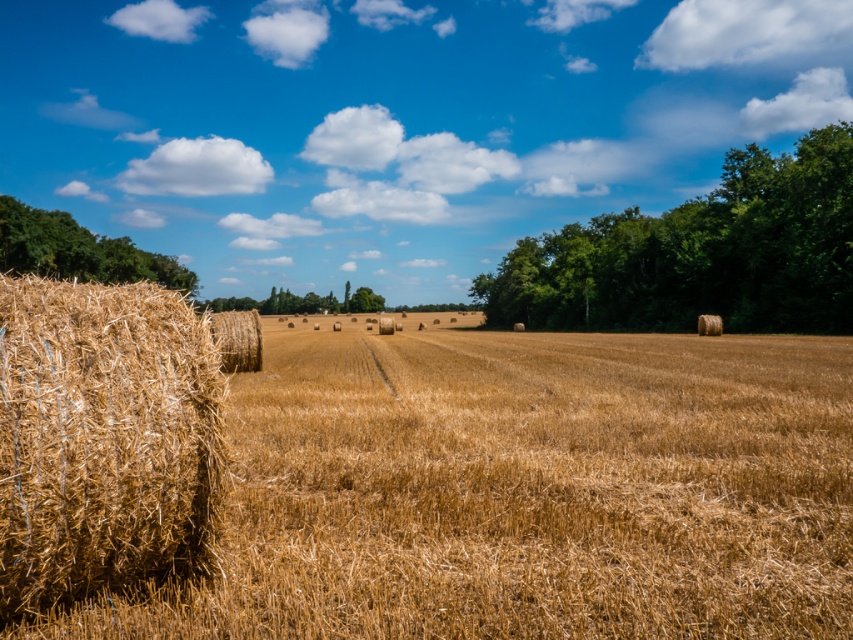
You are a farmer standing at the golden straw bale at left and want to reach the green leafy tree at upper left to check for pests. Considering your tractor has a maximum range of 140 meters before needing refueling, will you be able to reach the tree without refueling?

The distance between the golden straw bale at left and the green leafy tree at upper left is 150.03 meters, which exceeds the tractor maximum range of 140 meters. Therefore, you will need to refuel before reaching the tree.

You are standing at the point with coordinates point [103,440] in the rural landscape. What object are you standing on?

You are standing on the golden straw bale at left.